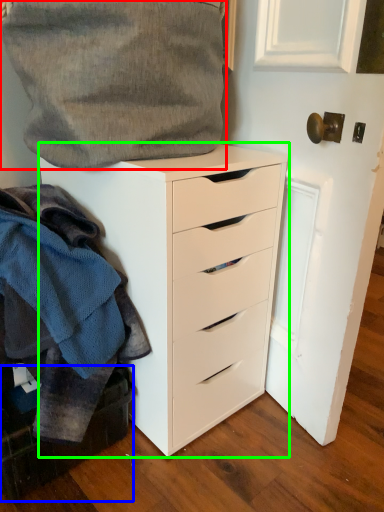
Question: Which object is the farthest from gray (highlighted by a red box)? Choose among these: cabinetry (highlighted by a blue box) or chest of drawers (highlighted by a green box).

Choices:
 (A) cabinetry
 (B) chest of drawers

Answer: (A)